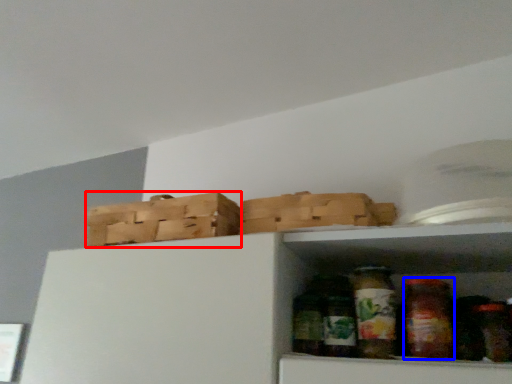
Question: Among these objects, which one is farthest to the camera, basket (highlighted by a red box) or glass jar (highlighted by a blue box)?

Choices:
 (A) basket
 (B) glass jar

Answer: (A)